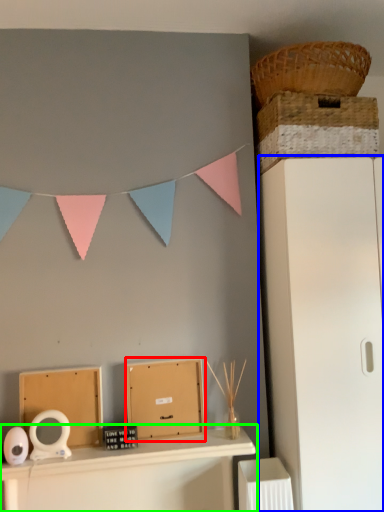
Question: Which object is the closest to the cardboard box (highlighted by a red box)? Choose among these: file cabinet (highlighted by a blue box) or furniture (highlighted by a green box).

Choices:
 (A) file cabinet
 (B) furniture

Answer: (B)